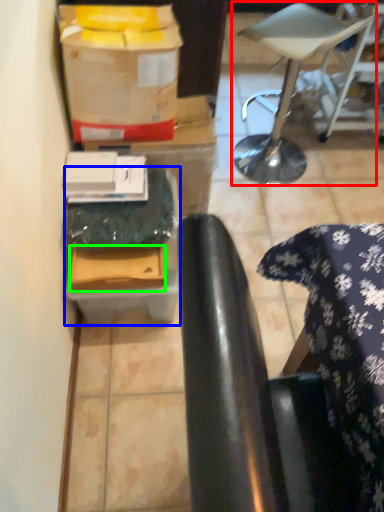
Question: Considering the real-world distances, which object is closest to furniture (highlighted by a red box)? cardboard box (highlighted by a blue box) or cardboard box (highlighted by a green box).

Choices:
 (A) cardboard box
 (B) cardboard box

Answer: (A)